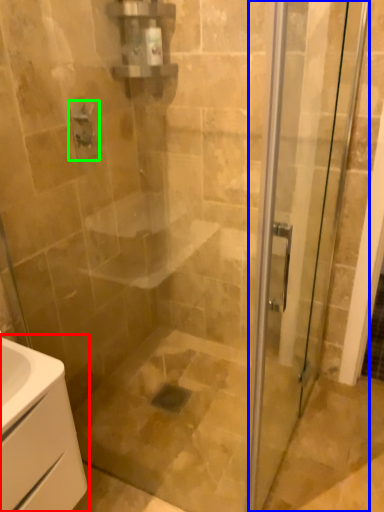
Question: Estimate the real-world distances between objects in this image. Which object is closer to bathroom cabinet (highlighted by a red box), door (highlighted by a blue box) or shower (highlighted by a green box)?

Choices:
 (A) door
 (B) shower

Answer: (A)